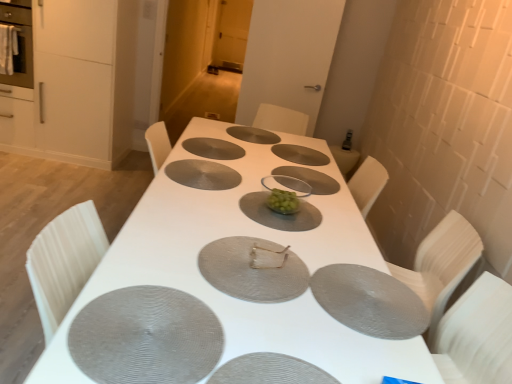
You are a GUI agent. You are given a task and a screenshot of the screen. Output one action in this format:
    pyautogui.click(x=<x>, y=<y>)
    Task: Click on the vacant space that's between metallic silver pizza pan at center, positioned as the 5th pizza pan in back-to-front order, and gray textured placemat at lower right, which is the sixth pizza pan in back-to-front order
    
    Given the screenshot: What is the action you would take?
    pyautogui.click(x=306, y=273)